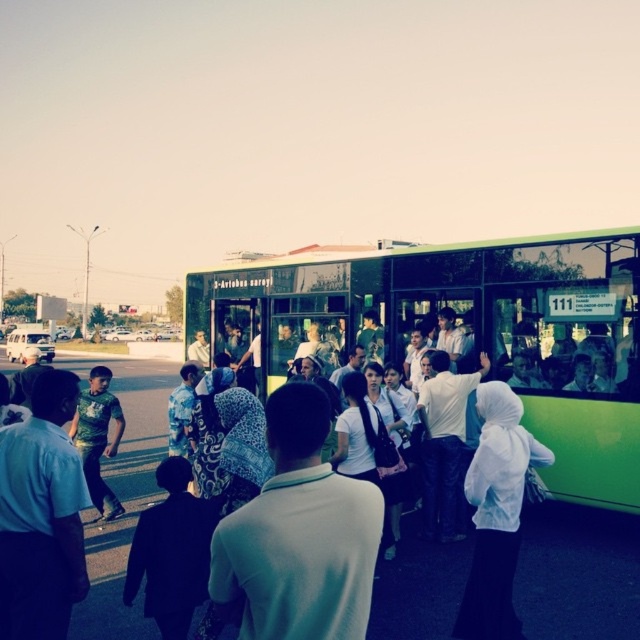
Question: Which point is closer to the camera?

Choices:
 (A) (600, 268)
 (B) (12, 564)
 (C) (259, 580)

Answer: (C)

Question: Observing the image, what is the correct spatial positioning of green matte bus at center in reference to light blue shirt at left?

Choices:
 (A) below
 (B) above

Answer: (B)

Question: Does white fabric headscarf at center appear over light blue shirt at left?

Choices:
 (A) no
 (B) yes

Answer: (B)

Question: Among these points, which one is farthest from the camera?

Choices:
 (A) (612, 396)
 (B) (1, 456)

Answer: (A)

Question: Is green matte bus at center further to the viewer compared to white fabric headscarf at center?

Choices:
 (A) yes
 (B) no

Answer: (A)

Question: Among these points, which one is nearest to the camera?

Choices:
 (A) (218, 525)
 (B) (600, 340)

Answer: (A)